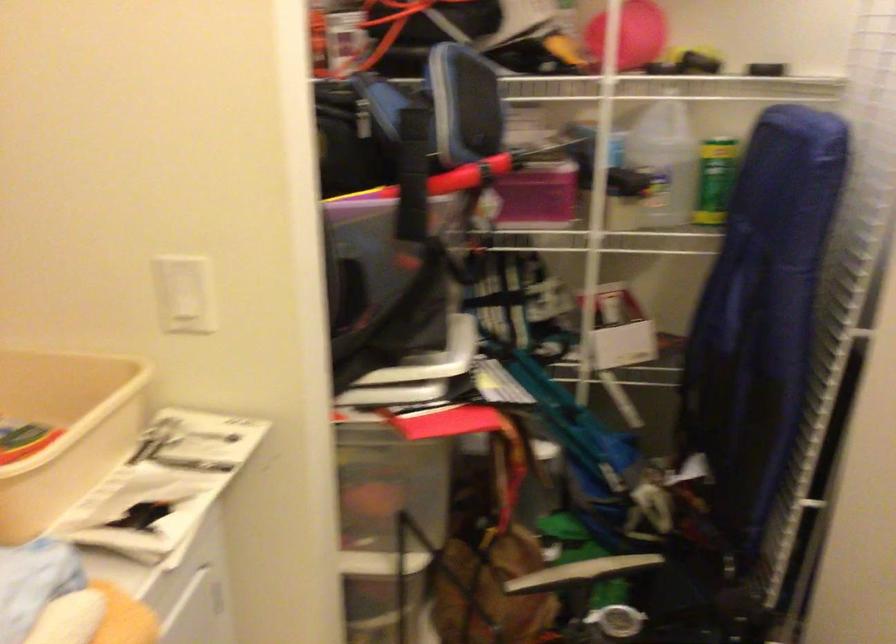
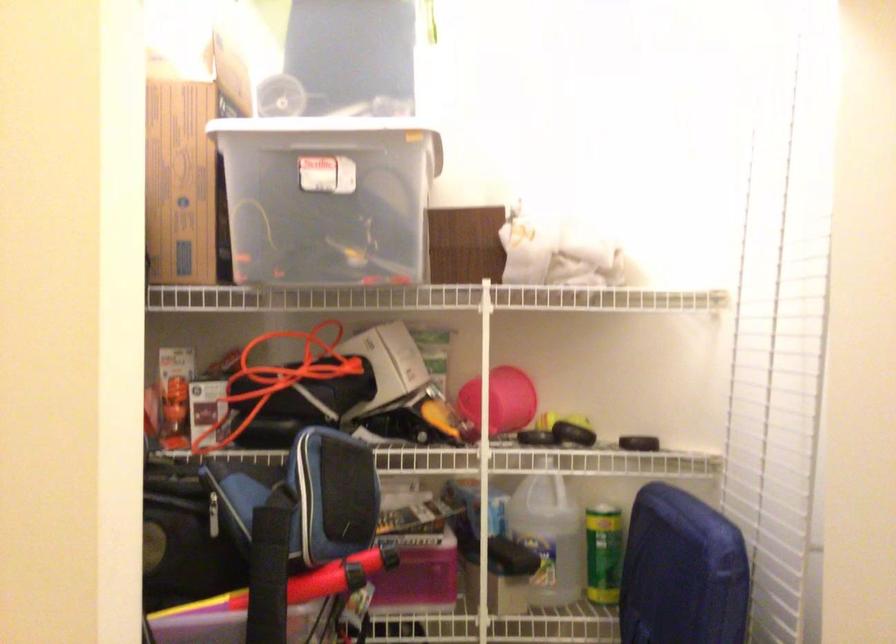
Find the pixel in the second image that matches (664,161) in the first image.

(548, 536)